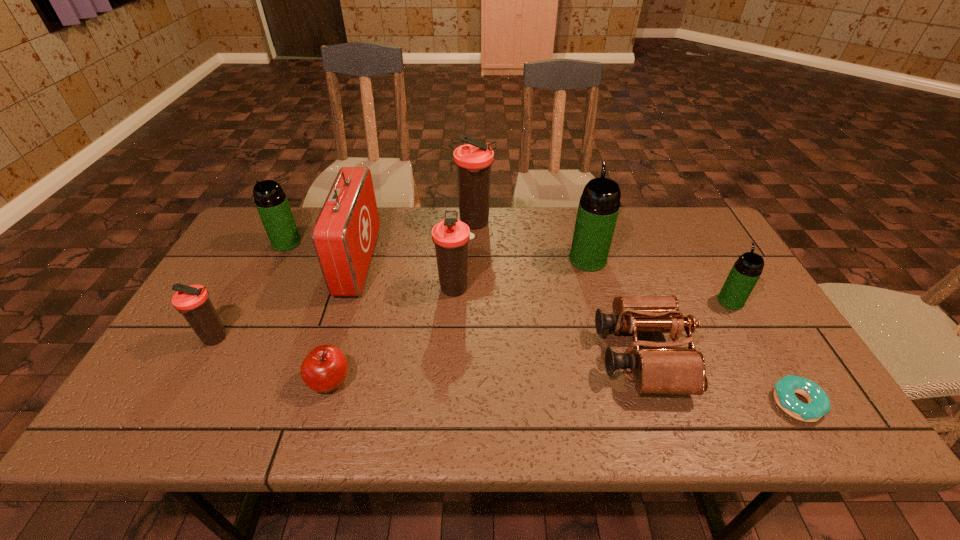
Find the location of a particular element. vacant space located on the front of the second smallest brown thermos bottle is located at coordinates (452, 361).

Where is `vacant space positioned 0.290m from the spout of the rightmost green thermos bottle`? This screenshot has height=540, width=960. vacant space positioned 0.290m from the spout of the rightmost green thermos bottle is located at coordinates (689, 230).

In order to click on vacant area situated from the spout of the rightmost green thermos bottle in this screenshot , I will do `click(708, 264)`.

Where is `vacant space located from the spout of the rightmost green thermos bottle`? The image size is (960, 540). vacant space located from the spout of the rightmost green thermos bottle is located at coordinates (707, 259).

What are the coordinates of `free space located 0.330m on the back of the smallest brown thermos bottle` in the screenshot? It's located at (267, 245).

What are the coordinates of `vacant space situated 0.100m through the eyepieces of the third shortest object` in the screenshot? It's located at (558, 355).

At what (x,y) coordinates should I click in order to perform the action: click on blank area located through the eyepieces of the third shortest object. Please return your answer as a coordinate pair (x, y). The height and width of the screenshot is (540, 960). Looking at the image, I should click on (450, 355).

Find the location of a particular element. vacant space situated 0.380m through the eyepieces of the third shortest object is located at coordinates (442, 355).

Where is `vacant region located on the back of the pink apple`? The width and height of the screenshot is (960, 540). vacant region located on the back of the pink apple is located at coordinates (362, 272).

At what (x,y) coordinates should I click in order to perform the action: click on free space located 0.050m on the back of the shortest object. Please return your answer as a coordinate pair (x, y). The height and width of the screenshot is (540, 960). Looking at the image, I should click on (773, 363).